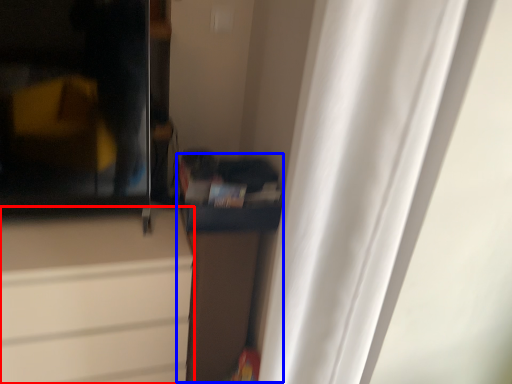
Question: Which object appears closest to the camera in this image, cabinetry (highlighted by a red box) or cabinetry (highlighted by a blue box)?

Choices:
 (A) cabinetry
 (B) cabinetry

Answer: (A)